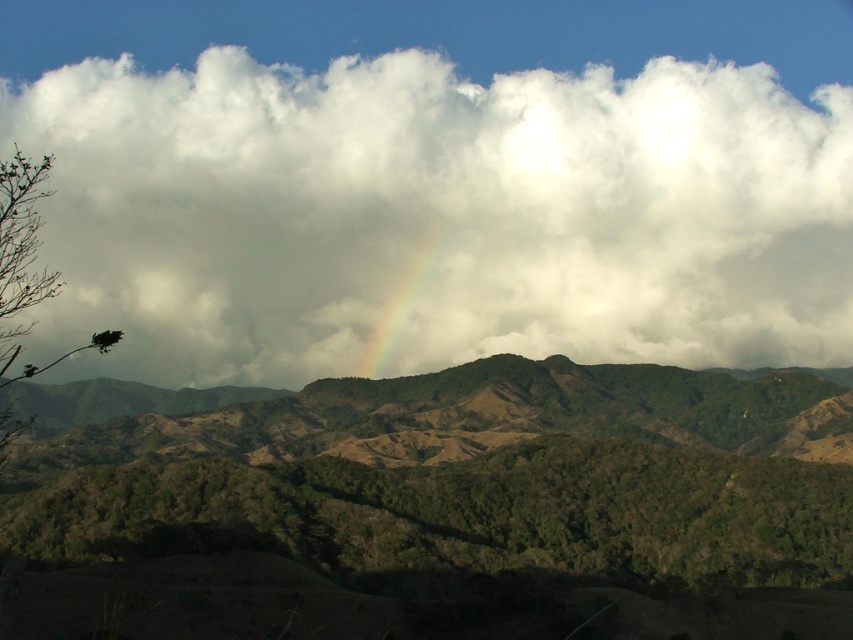
Who is taller, white fluffy cloud at upper center or brown textured tree at left?

white fluffy cloud at upper center is taller.

At what (x,y) coordinates should I click in order to perform the action: click on white fluffy cloud at upper center. Please return your answer as a coordinate pair (x, y). The width and height of the screenshot is (853, 640). Looking at the image, I should click on (436, 216).

I want to click on white fluffy cloud at upper center, so click(436, 216).

Who is taller, green leafy tree at center or rainbow at center?

With more height is rainbow at center.

Does point (396, 516) come closer to viewer compared to point (370, 360)?

Yes, point (396, 516) is in front of point (370, 360).

Which is in front, point (120, 522) or point (415, 252)?

Positioned in front is point (120, 522).

The height and width of the screenshot is (640, 853). Identify the location of green leafy tree at center. (468, 515).

Is white fluffy cloud at upper center to the left of green leafy tree at center from the viewer's perspective?

Indeed, white fluffy cloud at upper center is positioned on the left side of green leafy tree at center.

Between white fluffy cloud at upper center and green leafy tree at center, which one has more height?

With more height is white fluffy cloud at upper center.

Locate an element on the screen. Image resolution: width=853 pixels, height=640 pixels. white fluffy cloud at upper center is located at coordinates click(x=436, y=216).